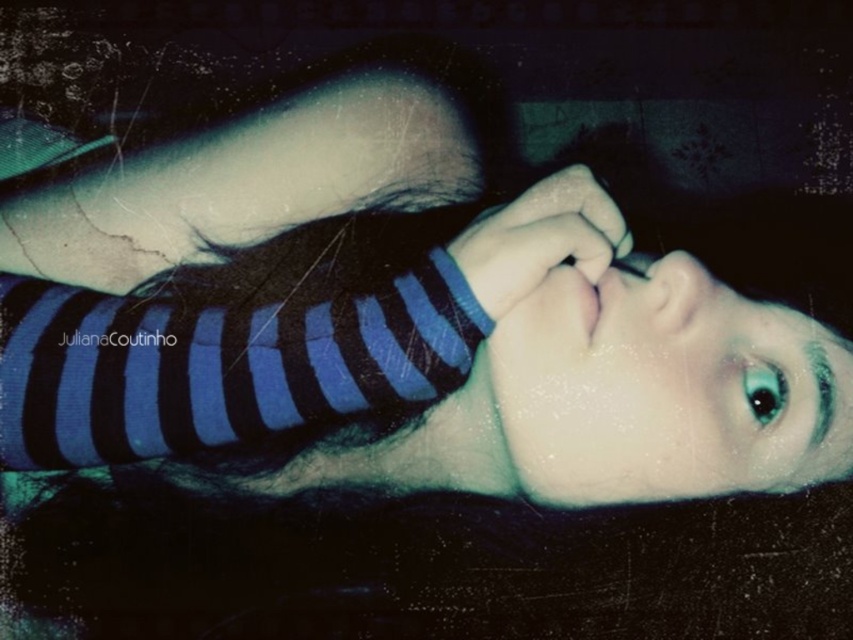
Who is positioned more to the left, smooth skin face at center or smooth skin hand at center?

smooth skin hand at center is more to the left.

Does smooth skin face at center appear on the left side of smooth skin hand at center?

In fact, smooth skin face at center is to the right of smooth skin hand at center.

The image size is (853, 640). I want to click on smooth skin face at center, so click(663, 388).

The image size is (853, 640). I want to click on smooth skin face at center, so click(x=663, y=388).

Looking at this image, is smooth skin face at center behind blue striped fabric at center?

Yes, smooth skin face at center is behind blue striped fabric at center.

Does smooth skin face at center come in front of blue striped fabric at center?

No.

Does point (619, 499) lie in front of point (440, 330)?

No, it is not.

I want to click on smooth skin face at center, so click(x=663, y=388).

Who is more distant from viewer, (x=210, y=310) or (x=775, y=404)?

Point (x=775, y=404)

The height and width of the screenshot is (640, 853). I want to click on blue striped shirt at center, so click(390, 317).